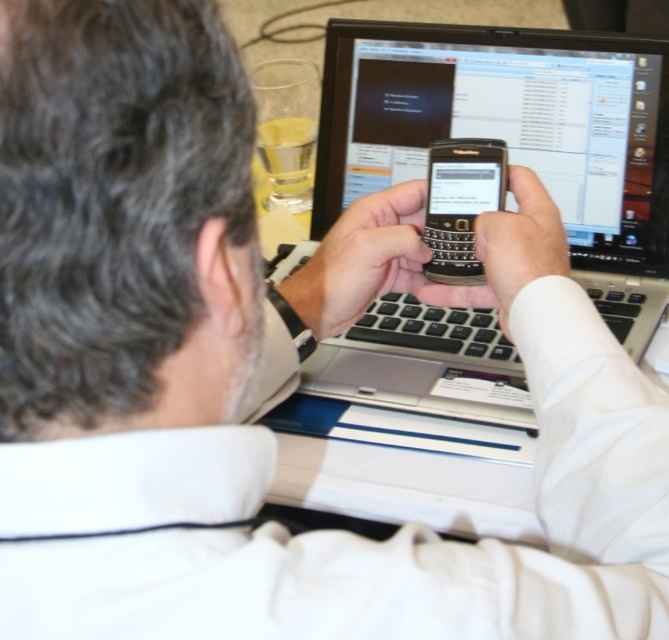
Is point (575, 131) farther from viewer compared to point (460, 140)?

Yes.

Measure the distance between silver metallic laptop at center and camera.

They are 73.49 centimeters apart.

At what (x,y) coordinates should I click in order to perform the action: click on silver metallic laptop at center. Please return your answer as a coordinate pair (x, y). Looking at the image, I should click on (514, 136).